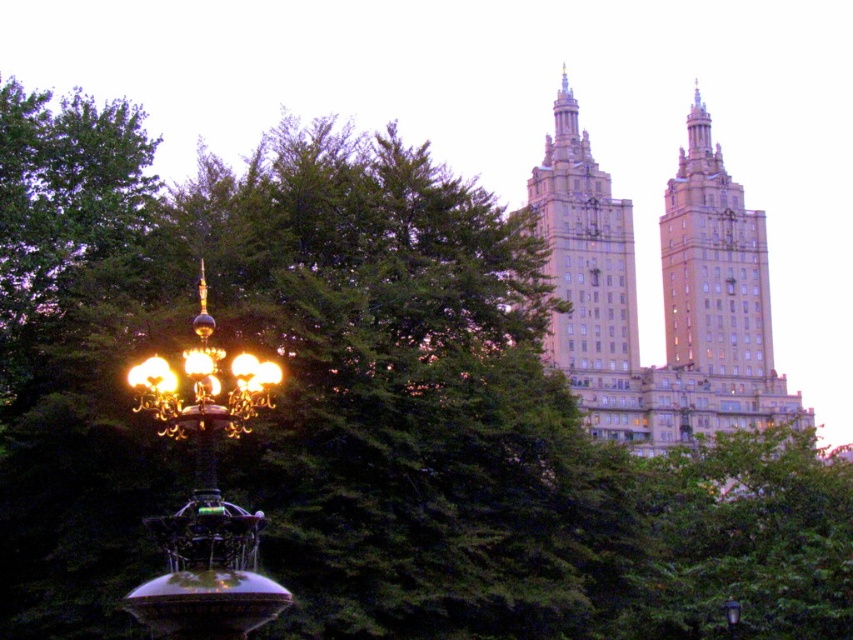
Is point (708, 298) positioned after point (560, 332)?

That is True.

Looking at this image, how far apart are beige stone building at upper right and beige stone tower at upper center?

The distance of beige stone building at upper right from beige stone tower at upper center is 20.19 feet.

Locate an element on the screen. The width and height of the screenshot is (853, 640). beige stone building at upper right is located at coordinates (662, 294).

At what (x,y) coordinates should I click in order to perform the action: click on beige stone building at upper right. Please return your answer as a coordinate pair (x, y). Image resolution: width=853 pixels, height=640 pixels. Looking at the image, I should click on (662, 294).

Is gold metallic street light at lower left taller than matte black street light at lower right?

Yes.

Which is below, gold metallic street light at lower left or matte black street light at lower right?

matte black street light at lower right is lower down.

At what (x,y) coordinates should I click in order to perform the action: click on gold metallic street light at lower left. Please return your answer as a coordinate pair (x, y). This screenshot has width=853, height=640. Looking at the image, I should click on (206, 499).

Identify the location of gold metallic street light at lower left. The height and width of the screenshot is (640, 853). click(x=206, y=499).

Is gold metallic street light at lower left smaller than beige stone tower at upper center?

Yes.

In order to click on gold metallic street light at lower left in this screenshot , I will do `click(206, 499)`.